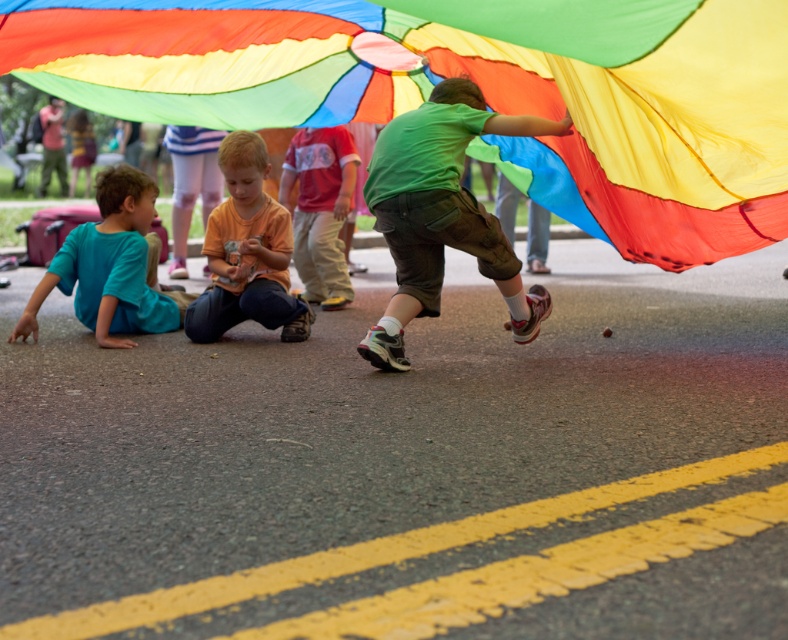
Question: In this image, where is rainbow fabric parachute at upper center located relative to orange cotton shirt at center?

Choices:
 (A) left
 (B) right

Answer: (B)

Question: Which point is farther to the camera?

Choices:
 (A) green matte shorts at center
 (B) rainbow fabric parachute at upper center
 (C) matte blue shirt at lower left
 (D) orange cotton shirt at center

Answer: (D)

Question: Does matte blue shirt at lower left appear over orange cotton shirt at center?

Choices:
 (A) no
 (B) yes

Answer: (A)

Question: Which point is farther to the camera?

Choices:
 (A) (145, 272)
 (B) (217, 243)
 (C) (701, 68)

Answer: (A)

Question: Which point is closer to the camera?

Choices:
 (A) rainbow fabric parachute at upper center
 (B) green matte shorts at center
 (C) matte blue shirt at lower left
 (D) orange cotton shirt at center

Answer: (A)

Question: Does green matte shorts at center come behind matte blue shirt at lower left?

Choices:
 (A) yes
 (B) no

Answer: (B)